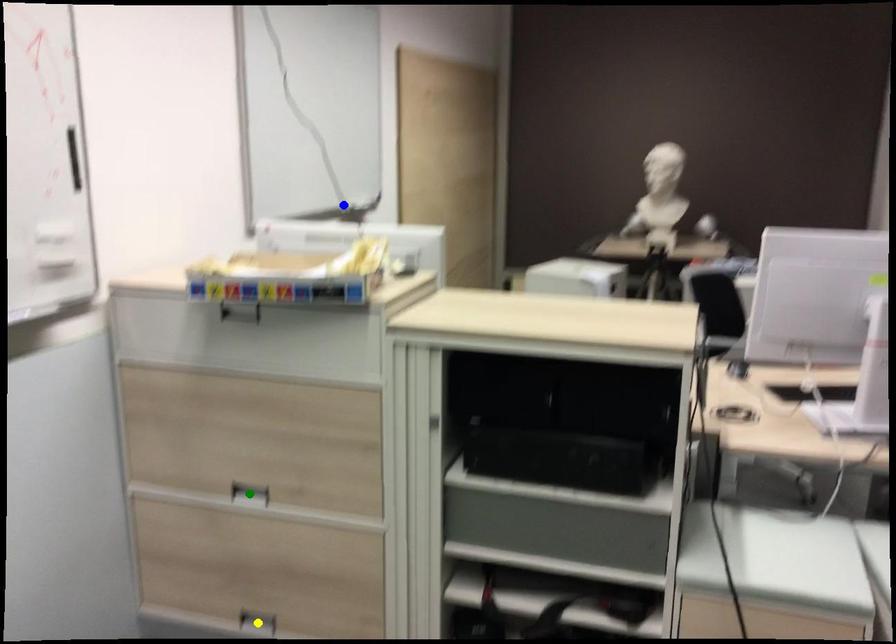
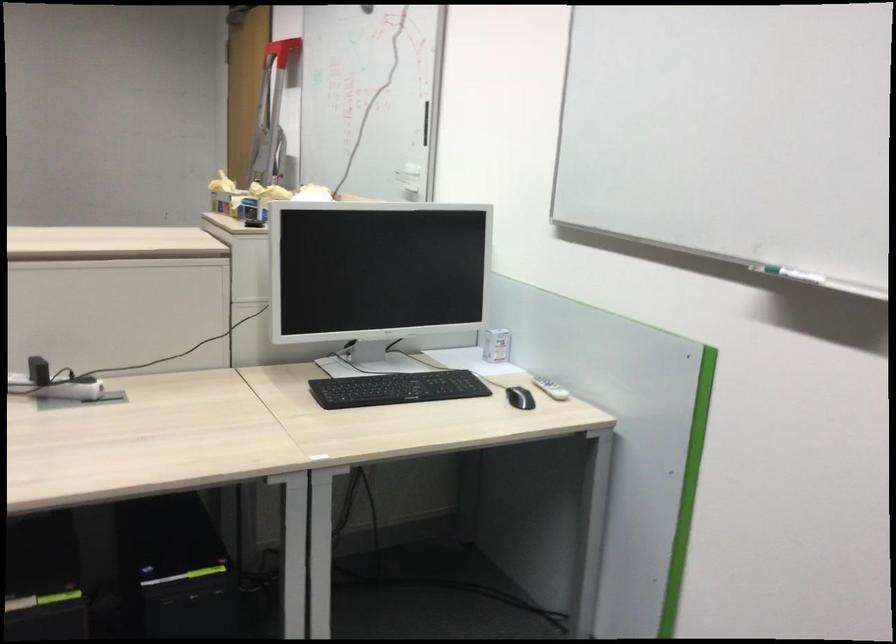
I am providing you with two images of the same scene from different viewpoints. Three points are marked in image1. Which point corresponds to a part or object that is occluded in image2?In image1, three points are marked. Which of them correspond to a part or object that is occluded in image2?Among the three points shown in image1, which one corresponds to a part or object that is no longer visible due to occlusion in image2?

green point, yellow point